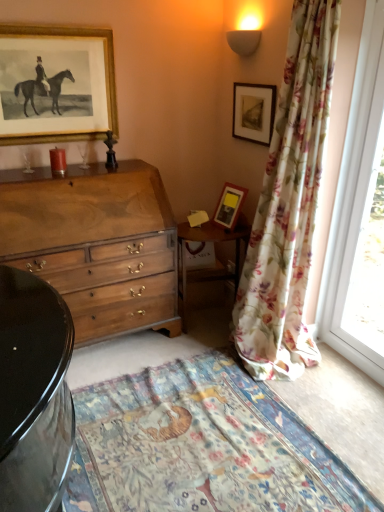
What do you see at coordinates (96, 244) in the screenshot?
I see `wooden chest of drawers at center` at bounding box center [96, 244].

Describe the element at coordinates (253, 112) in the screenshot. I see `matte black picture frame at upper right, acting as the third picture frame starting from the left` at that location.

From the picture: In order to face matte black picture frame at upper right, acting as the third picture frame starting from the left, should I rotate leftwards or rightwards?

Rotate right and turn 7.871 degrees.

How much space does matte wooden picture frame at upper right, the second picture frame in the right-to-left sequence, occupy vertically?

matte wooden picture frame at upper right, the second picture frame in the right-to-left sequence, is 13.45 inches in height.

Measure the distance between point (301, 100) and camera.

The depth of point (301, 100) is 2.03 meters.

The height and width of the screenshot is (512, 384). Identify the location of wooden table at center. (216, 259).

Locate an element on the screen. The image size is (384, 512). wooden chest of drawers at center is located at coordinates (96, 244).

The image size is (384, 512). What are the coordinates of `the 2nd picture frame positioned above the wooden table at center (from a real-world perspective)` in the screenshot? It's located at (253, 112).

Between point (188, 240) and point (262, 111), which one is positioned in front?

Positioned in front is point (262, 111).

Would you consider wooden table at center to be distant from matte black picture frame at upper right, the 1th picture frame positioned from the right?

No, there isn't a large distance between wooden table at center and matte black picture frame at upper right, the 1th picture frame positioned from the right.

Is wooden table at center looking in the opposite direction of matte black picture frame at upper right, acting as the third picture frame starting from the left?

wooden table at center is not turned away from matte black picture frame at upper right, acting as the third picture frame starting from the left.

From the image's perspective, is floral cotton blanket at lower center under transparent glass window at right?

Yes.

Between floral cotton blanket at lower center and transparent glass window at right, which one has more height?

Standing taller between the two is transparent glass window at right.

Considering the positions of objects floral cotton blanket at lower center and transparent glass window at right in the image provided, who is more to the left, floral cotton blanket at lower center or transparent glass window at right?

Positioned to the left is floral cotton blanket at lower center.

How many degrees apart are the facing directions of floral cotton blanket at lower center and transparent glass window at right?

They differ by 2.74 degrees in their facing directions.

Is transparent glass window at right aimed at matte black picture frame at upper right, the 1th picture frame positioned from the right?

No, transparent glass window at right is not turned towards matte black picture frame at upper right, the 1th picture frame positioned from the right.

Is transparent glass window at right closer to camera compared to matte black picture frame at upper right, acting as the third picture frame starting from the left?

Yes, it is in front of matte black picture frame at upper right, acting as the third picture frame starting from the left.

From the image's perspective, which one is positioned higher, transparent glass window at right or matte black picture frame at upper right, the 1th picture frame positioned from the right?

matte black picture frame at upper right, the 1th picture frame positioned from the right.

Is matte wooden picture frame at upper right, the second picture frame from the left, to the left or to the right of wooden table at center in the image?

Based on their positions, matte wooden picture frame at upper right, the second picture frame from the left, is located to the right of wooden table at center.

Is wooden table at center located within matte wooden picture frame at upper right, the second picture frame from the left?

No, wooden table at center is not inside matte wooden picture frame at upper right, the second picture frame from the left.

From a real-world perspective, is matte wooden picture frame at upper right, the second picture frame from the left, physically located above or below wooden table at center?

matte wooden picture frame at upper right, the second picture frame from the left, is above wooden table at center.

Based on the photo, which is less distant, [105,48] or [236,221]?

Point [105,48].

Is gold-framed print at upper left, which ranks as the 3th picture frame in right-to-left order, situated inside matte wooden picture frame at upper right, the second picture frame in the right-to-left sequence, or outside?

gold-framed print at upper left, which ranks as the 3th picture frame in right-to-left order, lies outside matte wooden picture frame at upper right, the second picture frame in the right-to-left sequence.

From a real-world perspective, which is physically below, gold-framed print at upper left, the first picture frame from the left, or matte wooden picture frame at upper right, the second picture frame from the left?

From a 3D spatial view, matte wooden picture frame at upper right, the second picture frame from the left, is below.

Is gold-framed print at upper left, the first picture frame from the left, bigger than matte wooden picture frame at upper right, the second picture frame from the left?

Yes, gold-framed print at upper left, the first picture frame from the left, is bigger than matte wooden picture frame at upper right, the second picture frame from the left.

Looking at this image, from the image's perspective, is floral fabric curtain at right positioned above or below floral cotton blanket at lower center?

floral fabric curtain at right is situated higher than floral cotton blanket at lower center in the image.

Considering the sizes of objects floral fabric curtain at right and floral cotton blanket at lower center in the image provided, who is taller, floral fabric curtain at right or floral cotton blanket at lower center?

floral fabric curtain at right is taller.

Is floral fabric curtain at right turned away from floral cotton blanket at lower center?

No.

Can you confirm if floral fabric curtain at right is smaller than floral cotton blanket at lower center?

No.

From the image's perspective, which one is positioned lower, transparent glass window at right or wooden table at center?

wooden table at center, from the image's perspective.

Are transparent glass window at right and wooden table at center far apart?

That's not correct — transparent glass window at right is a little close to wooden table at center.

Is transparent glass window at right behind wooden table at center?

No, transparent glass window at right is in front of wooden table at center.

Could you tell me if transparent glass window at right is turned towards wooden table at center?

No, transparent glass window at right is not aimed at wooden table at center.

Image resolution: width=384 pixels, height=512 pixels. In the image, there is a matte black picture frame at upper right, acting as the third picture frame starting from the left. Identify the location of table below it (from the image's perspective). (216, 259).

Identify the location of window behind the floral cotton blanket at lower center. (355, 196).

Estimate the real-world distances between objects in this image. Which object is closer to floral cotton blanket at lower center, transparent glass window at right or wooden table at center?

wooden table at center lies closer to floral cotton blanket at lower center than the other object.

Consider the image. Looking at the image, which one is located further to matte wooden picture frame at upper right, the second picture frame in the right-to-left sequence, wooden chest of drawers at center or wooden table at center?

wooden chest of drawers at center lies further to matte wooden picture frame at upper right, the second picture frame in the right-to-left sequence, than the other object.

Looking at the image, which one is located closer to floral fabric curtain at right, transparent glass window at right or wooden chest of drawers at center?

transparent glass window at right is positioned closer to the anchor floral fabric curtain at right.

Considering their positions, is floral cotton blanket at lower center positioned further to wooden table at center than floral fabric curtain at right?

Based on the image, floral cotton blanket at lower center appears to be further to wooden table at center.

Considering their positions, is matte black picture frame at upper right, the 1th picture frame positioned from the right, positioned further to floral cotton blanket at lower center than matte wooden picture frame at upper right, the second picture frame from the left?

matte black picture frame at upper right, the 1th picture frame positioned from the right, is further to floral cotton blanket at lower center.

Considering their positions, is matte black picture frame at upper right, acting as the third picture frame starting from the left, positioned closer to gold-framed print at upper left, which ranks as the 3th picture frame in right-to-left order, than matte wooden picture frame at upper right, the second picture frame in the right-to-left sequence?

Among the two, matte black picture frame at upper right, acting as the third picture frame starting from the left, is located nearer to gold-framed print at upper left, which ranks as the 3th picture frame in right-to-left order.

From the image, which object appears to be farther from matte wooden picture frame at upper right, the second picture frame from the left, wooden chest of drawers at center or floral cotton blanket at lower center?

Among the two, floral cotton blanket at lower center is located further to matte wooden picture frame at upper right, the second picture frame from the left.

Which object lies further to the anchor point matte wooden picture frame at upper right, the second picture frame from the left, floral fabric curtain at right or wooden chest of drawers at center?

wooden chest of drawers at center.

Identify the location of window between matte black picture frame at upper right, the 1th picture frame positioned from the right, and floral cotton blanket at lower center from top to bottom. (355, 196).

Identify the location of window between floral fabric curtain at right and wooden table at center in the front-back direction. The image size is (384, 512). (355, 196).

Find the location of a particular element. Image resolution: width=384 pixels, height=512 pixels. the chest of drawers between gold-framed print at upper left, the first picture frame from the left, and wooden table at center vertically is located at coordinates click(x=96, y=244).

Where is `window positioned between floral fabric curtain at right and matte wooden picture frame at upper right, the second picture frame in the right-to-left sequence, from near to far`? This screenshot has height=512, width=384. window positioned between floral fabric curtain at right and matte wooden picture frame at upper right, the second picture frame in the right-to-left sequence, from near to far is located at coordinates (355, 196).